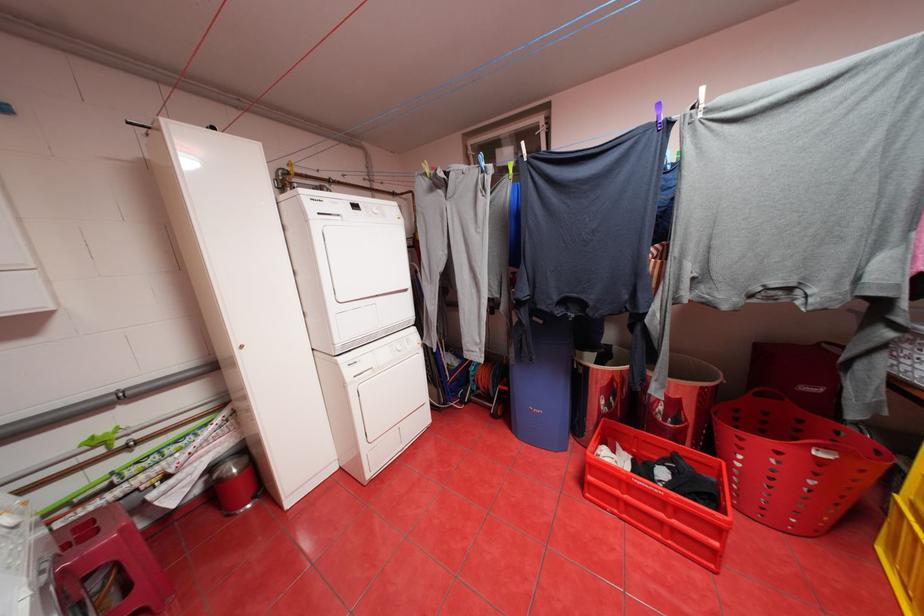
Describe the element at coordinates (366, 261) in the screenshot. I see `the upper dryer door` at that location.